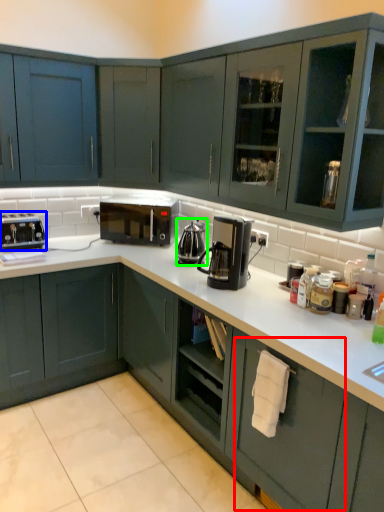
Question: Considering the real-world distances, which object is closest to drawer (highlighted by a red box)? kitchen appliance (highlighted by a blue box) or coffeepot (highlighted by a green box).

Choices:
 (A) kitchen appliance
 (B) coffeepot

Answer: (B)